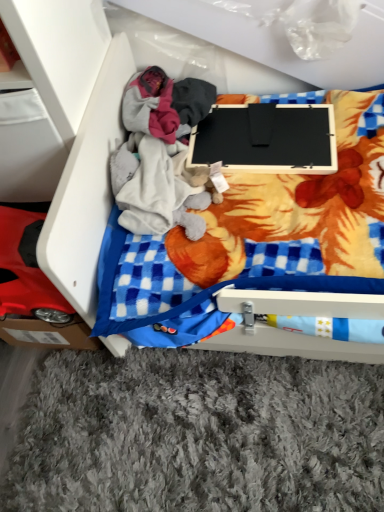
Where is `vacant area on top of black matte laptop at center (from a real-world perspective)`? vacant area on top of black matte laptop at center (from a real-world perspective) is located at coordinates (251, 126).